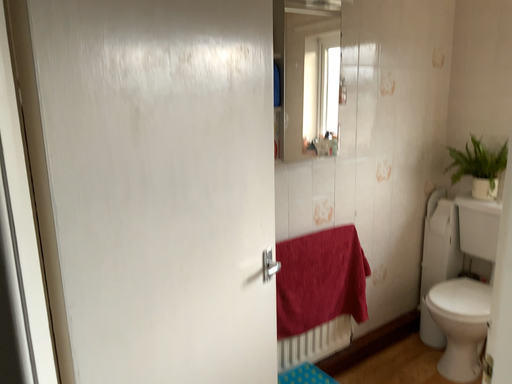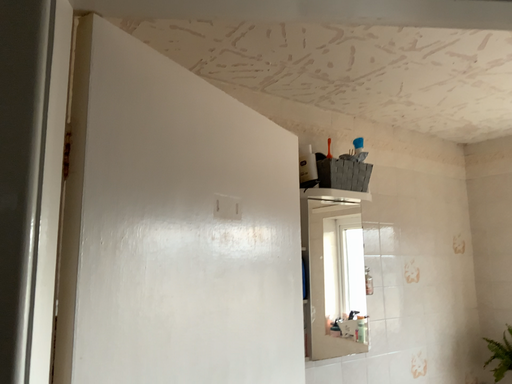
Question: Which way did the camera rotate in the video?

Choices:
 (A) rotated downward
 (B) rotated upward

Answer: (B)